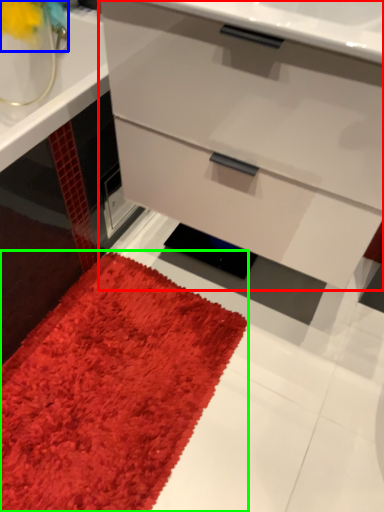
Question: Which object is the farthest from chest of drawers (highlighted by a red box)? Choose among these: flower (highlighted by a blue box) or mat (highlighted by a green box).

Choices:
 (A) flower
 (B) mat

Answer: (A)